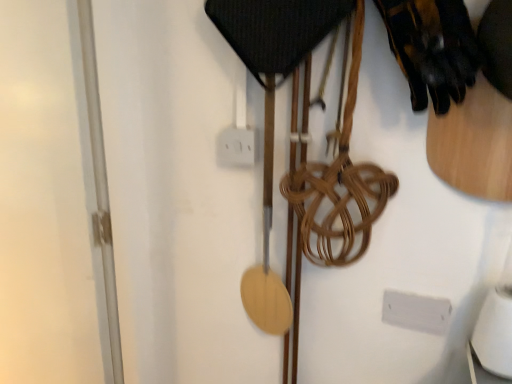
Question: From the image's perspective, is white plastic electric outlet at center above or below transparent glass door at left?

Choices:
 (A) below
 (B) above

Answer: (B)

Question: Considering their positions, is white plastic electric outlet at center located in front of or behind transparent glass door at left?

Choices:
 (A) behind
 (B) front

Answer: (A)

Question: Considering the real-world distances, which object is closest to the black leather gloves at upper right?

Choices:
 (A) transparent glass door at left
 (B) white plastic electric outlet at center

Answer: (B)

Question: Which object is positioned closest to the white plastic electric outlet at center?

Choices:
 (A) transparent glass door at left
 (B) black leather gloves at upper right

Answer: (B)